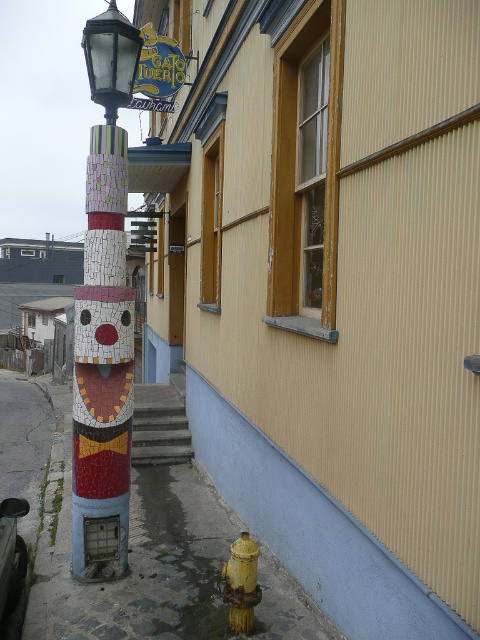
Is matte glass street light at upper left closer to camera compared to yellow matte hydrant at lower right?

No, matte glass street light at upper left is further to the viewer.

Does matte glass street light at upper left appear on the right side of yellow matte hydrant at lower right?

No, matte glass street light at upper left is not to the right of yellow matte hydrant at lower right.

Is point (101, 84) behind point (253, 602)?

Yes, point (101, 84) is behind point (253, 602).

I want to click on matte glass street light at upper left, so click(x=110, y=58).

Measure the distance from smooth concrete sidewalk at lower left to mosaic totem pole at left.

A distance of 7.17 feet exists between smooth concrete sidewalk at lower left and mosaic totem pole at left.

Who is shorter, smooth concrete sidewalk at lower left or mosaic totem pole at left?

With less height is smooth concrete sidewalk at lower left.

At what (x,y) coordinates should I click in order to perform the action: click on smooth concrete sidewalk at lower left. Please return your answer as a coordinate pair (x, y). This screenshot has width=480, height=640. Looking at the image, I should click on 154,563.

From the picture: Which is above, smooth concrete sidewalk at lower left or matte glass street light at upper left?

matte glass street light at upper left

Can you confirm if smooth concrete sidewalk at lower left is taller than matte glass street light at upper left?

No.

Describe the element at coordinates (154, 563) in the screenshot. Image resolution: width=480 pixels, height=640 pixels. I see `smooth concrete sidewalk at lower left` at that location.

Identify the location of smooth concrete sidewalk at lower left. This screenshot has height=640, width=480. (154, 563).